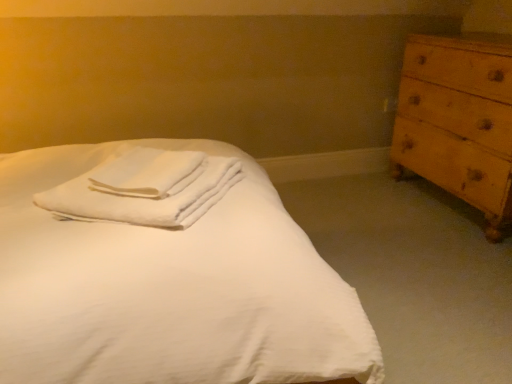
Question: Based on their sizes in the image, would you say wooden chest of drawers at right is bigger or smaller than white smooth bed at center?

Choices:
 (A) small
 (B) big

Answer: (A)

Question: From a real-world perspective, is wooden chest of drawers at right positioned above or below white smooth bed at center?

Choices:
 (A) above
 (B) below

Answer: (A)

Question: Based on their relative distances, which object is farther from the white soft towel at center?

Choices:
 (A) wooden chest of drawers at right
 (B) white cotton towels at center
 (C) white smooth bed at center

Answer: (A)

Question: Which object is positioned closest to the white cotton towels at center?

Choices:
 (A) white soft towel at center
 (B) wooden chest of drawers at right
 (C) white smooth bed at center

Answer: (A)